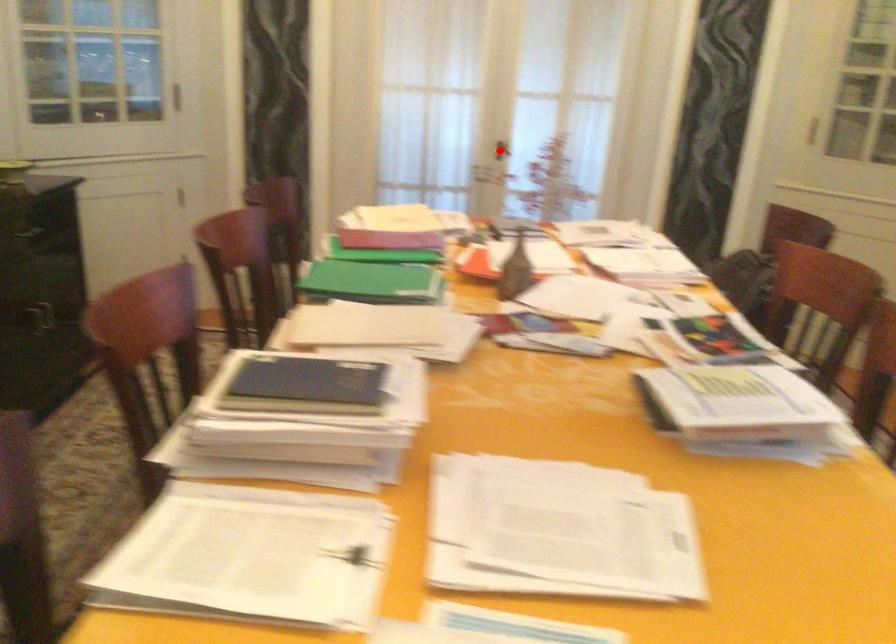
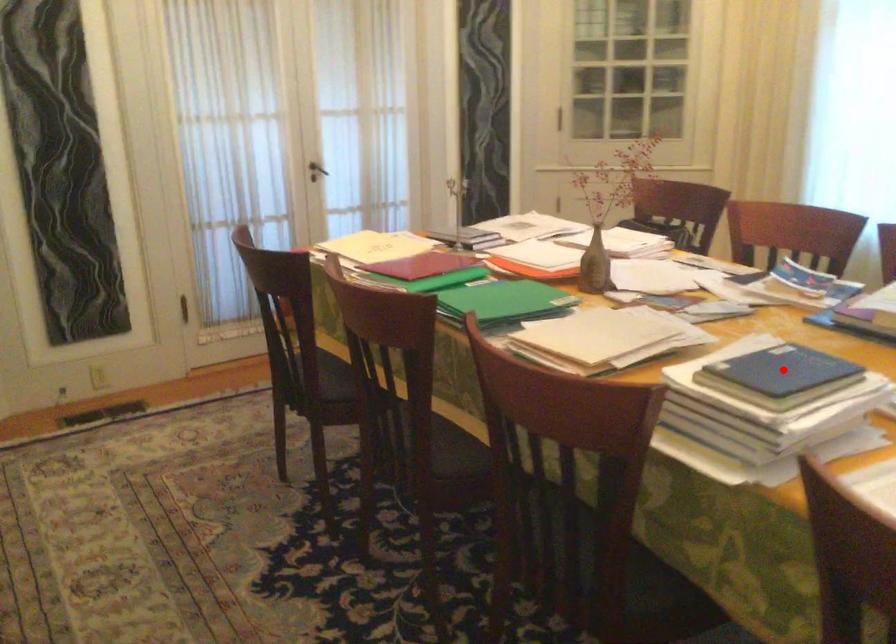
I am providing you with two images of the same scene from different viewpoints. A red point is marked on the first image and another point is marked on the second image. Do the highlighted points in image1 and image2 indicate the same real-world spot?

No